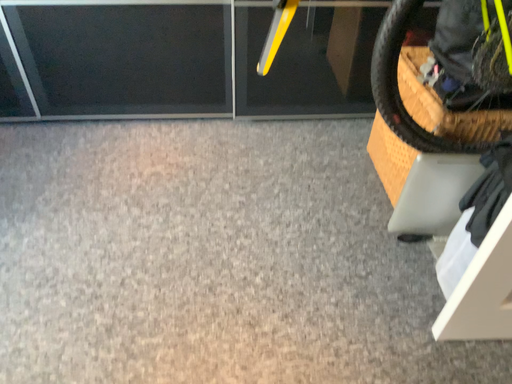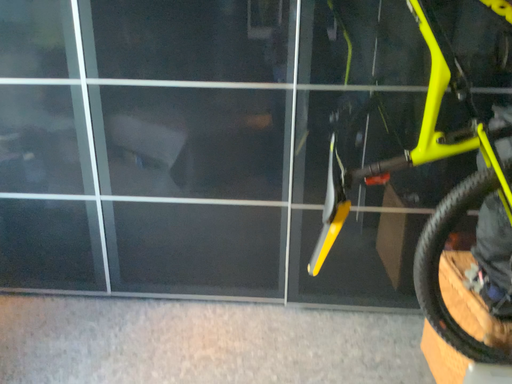
Question: How did the camera likely rotate when shooting the video?

Choices:
 (A) rotated upward
 (B) rotated downward

Answer: (A)